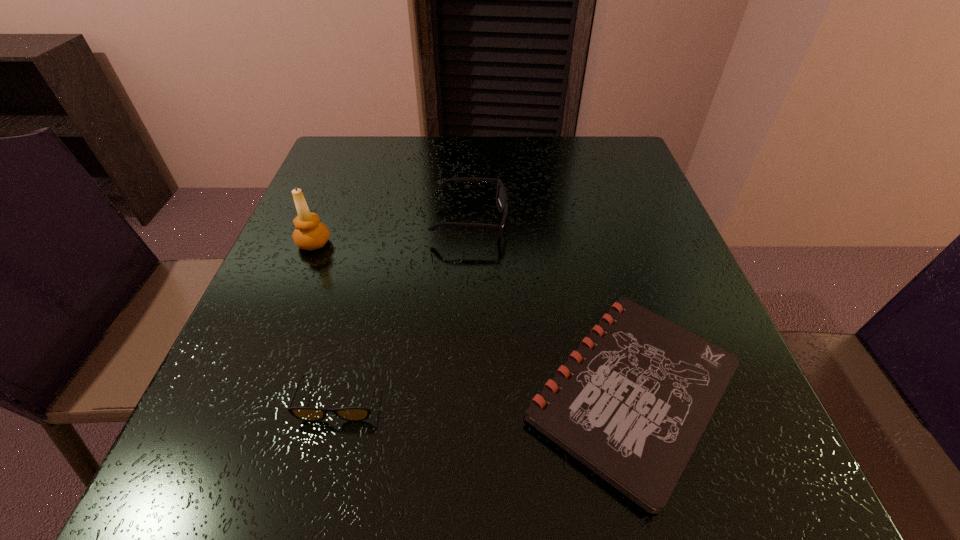
At what (x,y) coordinates should I click in order to perform the action: click on vacant position in the image that satisfies the following two spatial constraints: 1. on the front-facing side of the farther sunglasses; 2. on the front-facing side of the second object from left to right. Please return your answer as a coordinate pair (x, y). Looking at the image, I should click on (465, 401).

The height and width of the screenshot is (540, 960). Identify the location of vacant space that satisfies the following two spatial constraints: 1. on the front-facing side of the third shortest object; 2. on the front-facing side of the nearer sunglasses. (465, 401).

The height and width of the screenshot is (540, 960). I want to click on vacant space that satisfies the following two spatial constraints: 1. on the front-facing side of the right sunglasses; 2. on the right side of the rightmost object, so click(x=465, y=392).

This screenshot has width=960, height=540. I want to click on free region that satisfies the following two spatial constraints: 1. on the back side of the rightmost object; 2. on the front-facing side of the taller sunglasses, so click(x=586, y=221).

Identify the location of free space that satisfies the following two spatial constraints: 1. on the front-facing side of the third shortest object; 2. on the front-facing side of the third tallest object. (465, 401).

You are a GUI agent. You are given a task and a screenshot of the screen. Output one action in this format:
    pyautogui.click(x=<x>, y=<y>)
    Task: Click on the free spot that satisfies the following two spatial constraints: 1. on the front-facing side of the taller sunglasses; 2. on the front-facing side of the second shortest object
    
    Given the screenshot: What is the action you would take?
    pyautogui.click(x=465, y=401)

Locate an element on the screen. The height and width of the screenshot is (540, 960). free space that satisfies the following two spatial constraints: 1. on the front-facing side of the taller sunglasses; 2. on the right side of the notebook is located at coordinates (465, 392).